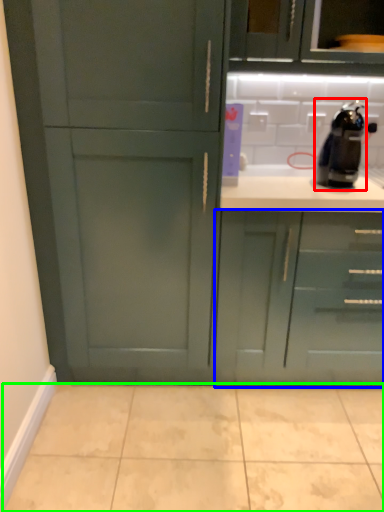
Question: Based on their relative distances, which object is farther from coffee machine (highlighted by a red box)? Choose from cabinetry (highlighted by a blue box) and ceramic tile (highlighted by a green box).

Choices:
 (A) cabinetry
 (B) ceramic tile

Answer: (B)